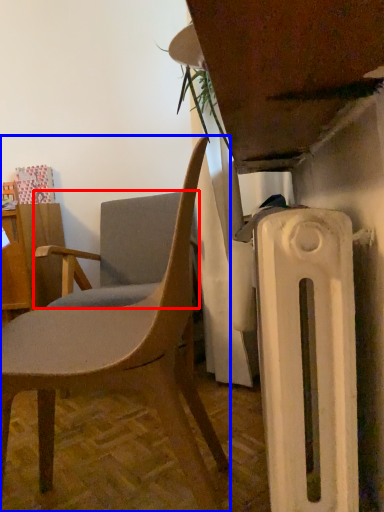
Question: Among these objects, which one is nearest to the camera, chair (highlighted by a red box) or chair (highlighted by a blue box)?

Choices:
 (A) chair
 (B) chair

Answer: (B)